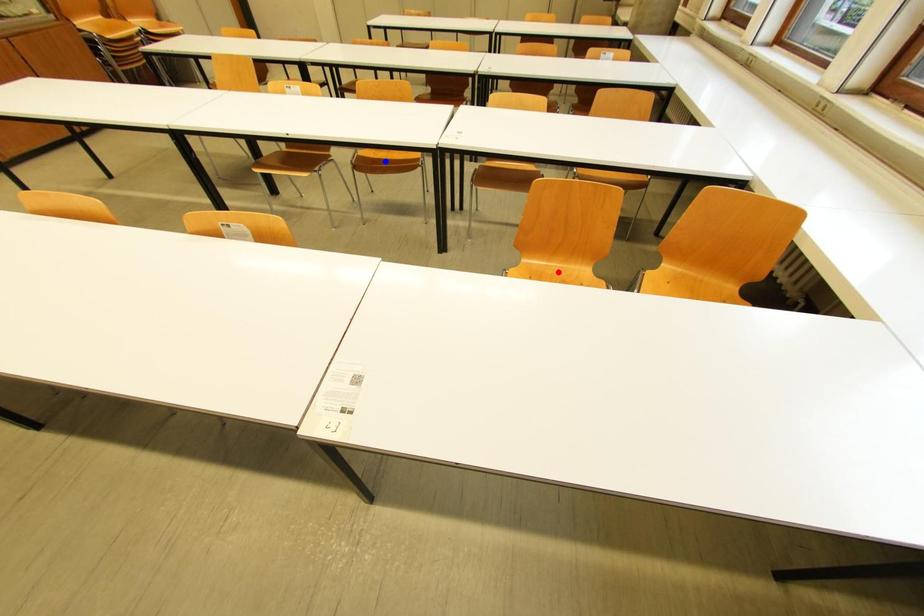
Question: In the image, two points are highlighted. Which point is nearer to the camera? Reply with the corresponding letter.

Choices:
 (A) blue point
 (B) red point

Answer: (B)